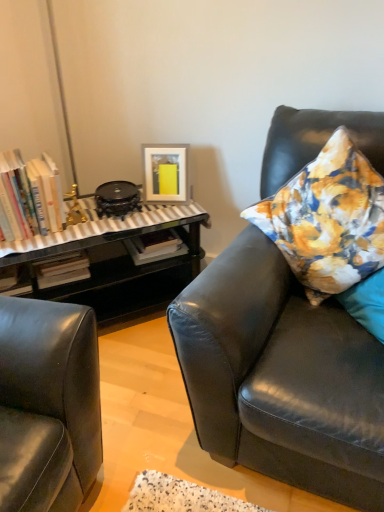
Question: Is hardcover books at left to the left or to the right of floral fabric pillow at right in the image?

Choices:
 (A) left
 (B) right

Answer: (A)

Question: Is point click(x=36, y=230) closer or farther from the camera than point click(x=365, y=198)?

Choices:
 (A) closer
 (B) farther

Answer: (B)

Question: Based on their relative distances, which object is farther from the hardcover books at left?

Choices:
 (A) matte black leather couch at right
 (B) floral fabric pillow at right
 (C) matte white picture frame at upper center

Answer: (A)

Question: Which is farther from the hardcover books at left?

Choices:
 (A) matte white picture frame at upper center
 (B) matte black leather couch at right
 (C) floral fabric pillow at right

Answer: (B)